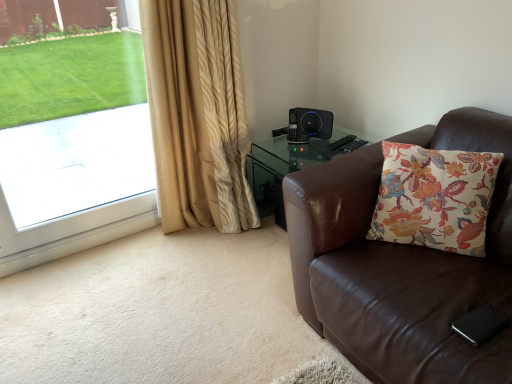
Question: Does black plastic speaker at upper right turn towards brown leather chair at right?

Choices:
 (A) yes
 (B) no

Answer: (B)

Question: Is black plastic speaker at upper right closer to the viewer compared to brown leather chair at right?

Choices:
 (A) no
 (B) yes

Answer: (A)

Question: Does black plastic speaker at upper right lie behind brown leather chair at right?

Choices:
 (A) no
 (B) yes

Answer: (B)

Question: Does black plastic speaker at upper right contain brown leather chair at right?

Choices:
 (A) no
 (B) yes

Answer: (A)

Question: From a real-world perspective, is black plastic speaker at upper right over brown leather chair at right?

Choices:
 (A) no
 (B) yes

Answer: (B)

Question: Do you think black plastic speaker at upper right is within brown leather chair at right, or outside of it?

Choices:
 (A) inside
 (B) outside

Answer: (B)

Question: From a real-world perspective, is black plastic speaker at upper right physically located above or below brown leather chair at right?

Choices:
 (A) below
 (B) above

Answer: (B)

Question: Is point (303, 137) closer or farther from the camera than point (417, 137)?

Choices:
 (A) farther
 (B) closer

Answer: (A)

Question: Considering their positions, is black plastic speaker at upper right located in front of or behind brown leather chair at right?

Choices:
 (A) behind
 (B) front

Answer: (A)

Question: Is beige textured curtain at left taller or shorter than floral fabric cushion at right?

Choices:
 (A) tall
 (B) short

Answer: (A)

Question: Considering the positions of point pyautogui.click(x=226, y=36) and point pyautogui.click(x=463, y=203), is point pyautogui.click(x=226, y=36) closer or farther from the camera than point pyautogui.click(x=463, y=203)?

Choices:
 (A) closer
 (B) farther

Answer: (B)

Question: Is beige textured curtain at left wider or thinner than floral fabric cushion at right?

Choices:
 (A) wide
 (B) thin

Answer: (A)

Question: From the image's perspective, relative to floral fabric cushion at right, is beige textured curtain at left above or below?

Choices:
 (A) above
 (B) below

Answer: (A)

Question: Is point (463, 157) closer or farther from the camera than point (61, 157)?

Choices:
 (A) farther
 (B) closer

Answer: (B)

Question: Considering the positions of floral fabric cushion at right and white glass window at left in the image, is floral fabric cushion at right wider or thinner than white glass window at left?

Choices:
 (A) wide
 (B) thin

Answer: (A)